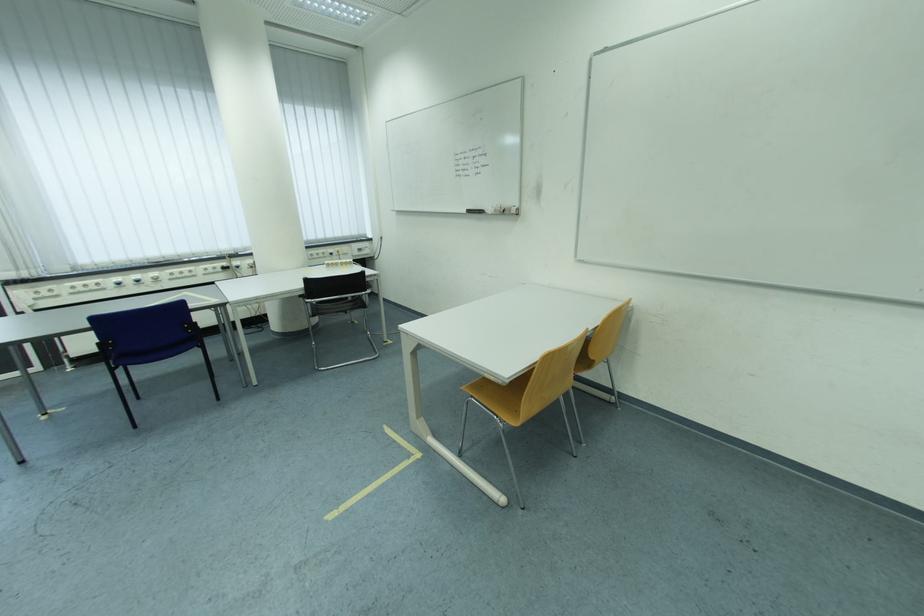
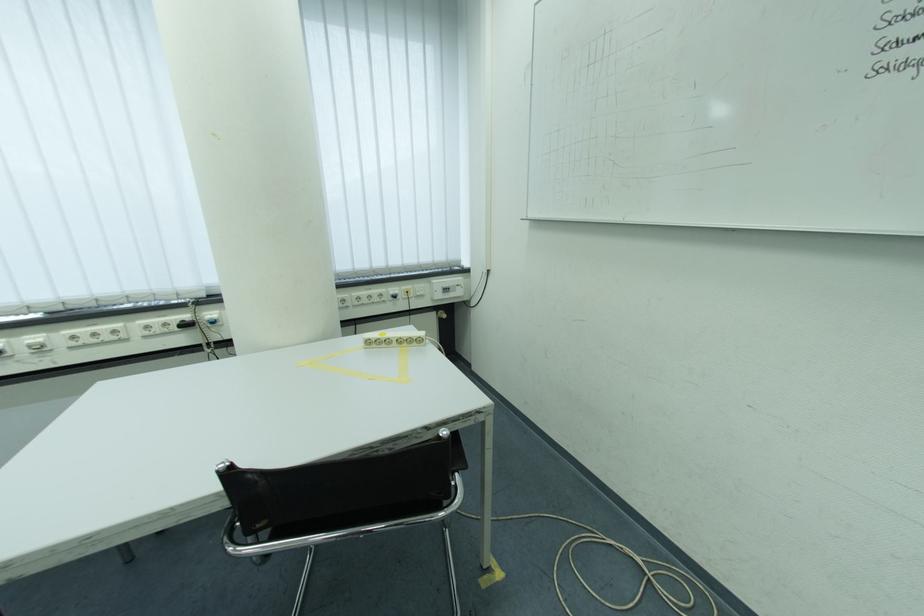
Question: The images are taken continuously from a first-person perspective. In which direction are you moving?

Choices:
 (A) Left
 (B) Right
 (C) Forward
 (D) Backward

Answer: (C)